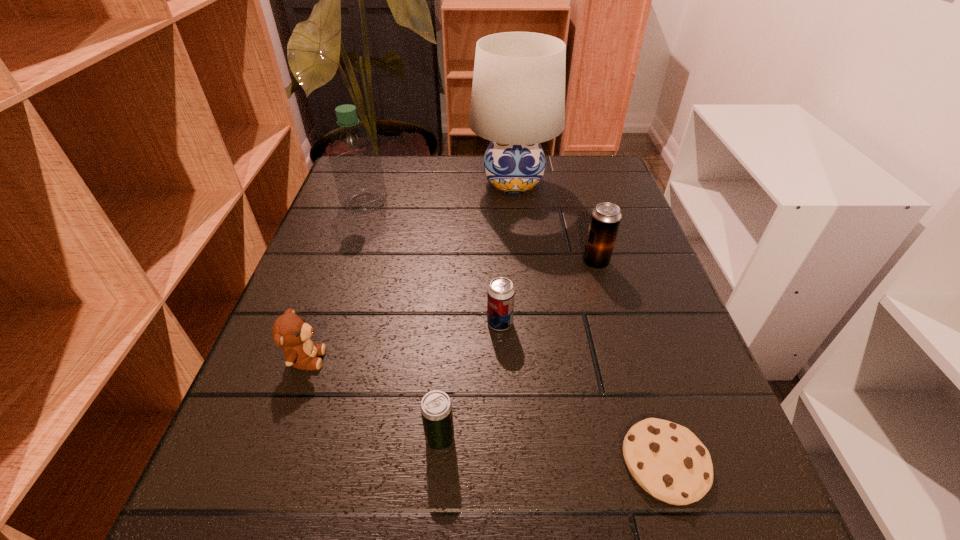
Find the location of a particular element. Image resolution: width=960 pixels, height=540 pixels. water bottle that is at the left edge is located at coordinates (355, 158).

The image size is (960, 540). I want to click on teddy bear located at the left edge, so click(x=291, y=332).

Where is `lampshade that is at the right edge`? Image resolution: width=960 pixels, height=540 pixels. lampshade that is at the right edge is located at coordinates (518, 93).

The height and width of the screenshot is (540, 960). I want to click on beer can that is at the right edge, so click(605, 220).

What are the coordinates of `cookie at the right edge` in the screenshot? It's located at (667, 460).

Where is `object that is positioned at the far left corner`? This screenshot has height=540, width=960. object that is positioned at the far left corner is located at coordinates (355, 158).

The height and width of the screenshot is (540, 960). Find the location of `object that is positioned at the far right corner`. object that is positioned at the far right corner is located at coordinates (518, 93).

At what (x,y) coordinates should I click in order to perform the action: click on object present at the near right corner. Please return your answer as a coordinate pair (x, y). Looking at the image, I should click on (667, 460).

In the image, there is a desktop. Identify the location of vacant area at the far edge. This screenshot has height=540, width=960. (476, 157).

Find the location of `vacant area at the near edge`. vacant area at the near edge is located at coordinates (408, 537).